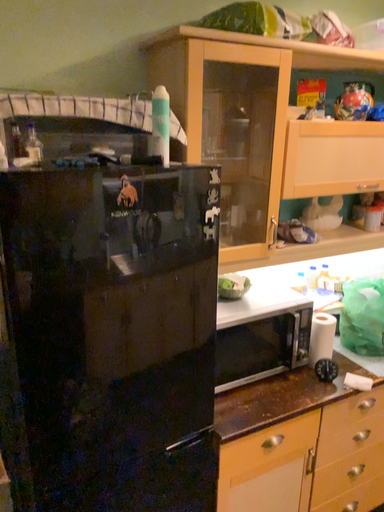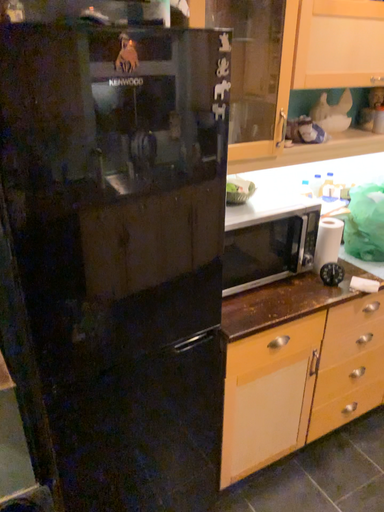
Question: Which way did the camera rotate in the video?

Choices:
 (A) rotated downward
 (B) rotated upward

Answer: (A)